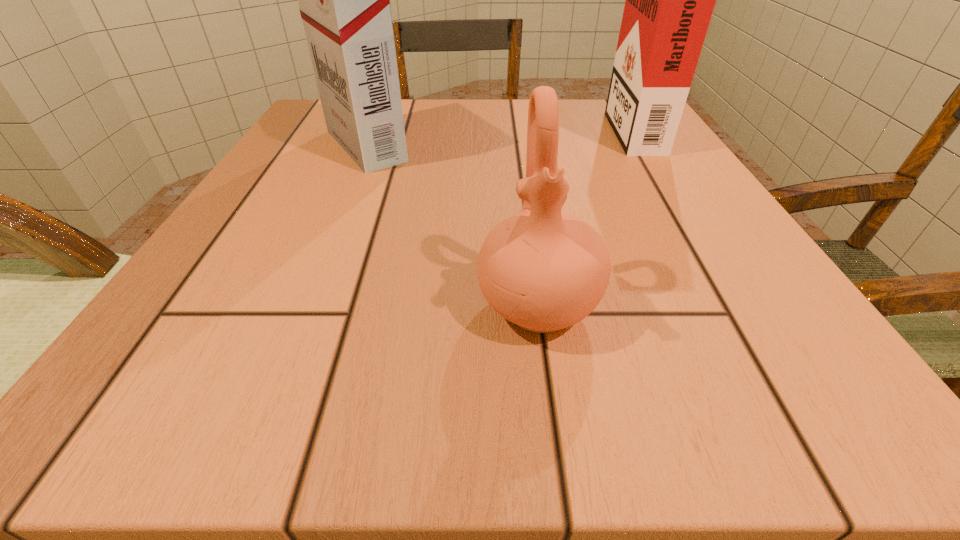
The width and height of the screenshot is (960, 540). I want to click on free space at the far right corner, so click(575, 107).

Find the location of a particular element. Image resolution: width=960 pixels, height=540 pixels. vacant region at the near right corner of the desktop is located at coordinates (762, 407).

Where is `free spot between the rightmost object and the pottery`? This screenshot has width=960, height=540. free spot between the rightmost object and the pottery is located at coordinates (585, 217).

Where is `free point between the rightmost object and the left cigarette case`? The width and height of the screenshot is (960, 540). free point between the rightmost object and the left cigarette case is located at coordinates (498, 137).

The image size is (960, 540). I want to click on vacant area that lies between the rightmost object and the nearest object, so click(585, 217).

Identify the location of unoccupied area between the nearest object and the leftmost object. (452, 226).

Find the location of a particular element. Image resolution: width=960 pixels, height=540 pixels. vacant area between the shorter cigarette case and the second object from right to left is located at coordinates (585, 217).

Find the location of a particular element. This screenshot has width=960, height=540. free spot between the leftmost object and the second object from left to right is located at coordinates pyautogui.click(x=452, y=226).

You are a GUI agent. You are given a task and a screenshot of the screen. Output one action in this format:
    pyautogui.click(x=<x>, y=<y>)
    Task: Click on the vacant point located between the left cigarette case and the shorter cigarette case
    The height and width of the screenshot is (540, 960).
    Given the screenshot: What is the action you would take?
    pyautogui.click(x=498, y=137)

Locate an element on the screen. The width and height of the screenshot is (960, 540). free spot between the shorter cigarette case and the second object from left to right is located at coordinates (585, 217).